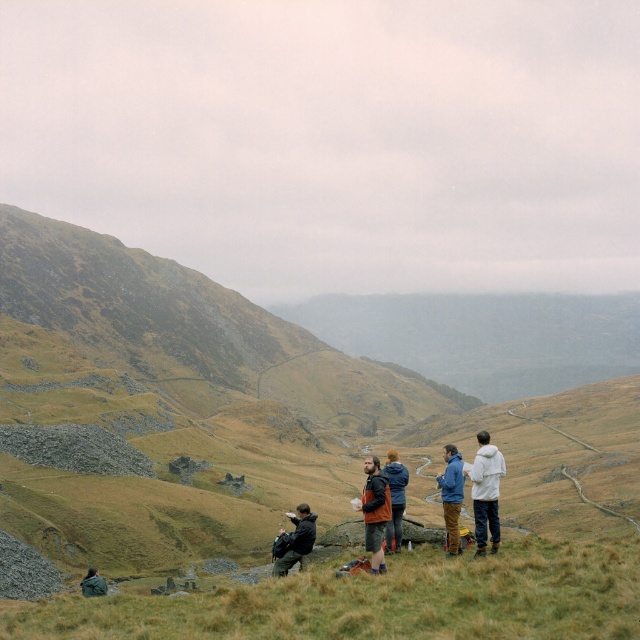
You are planning to set up a tent for a picnic in the area shown. Considering the green grassy at lower center and the dark gray jacket at center, which location would provide a more stable and spacious area for setting up the tent?

The green grassy at lower center has a larger width than the dark gray jacket at center, so it would provide a more stable and spacious area for setting up the tent.

You are a hiker who needs to move from the blue denim jacket at center to the green fabric jacket at lower left. What is the shortest distance you need to travel?

The shortest distance between the blue denim jacket at center and the green fabric jacket at lower left is 20.04 meters.